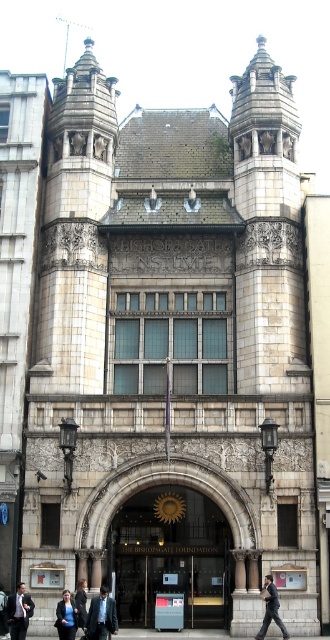
Question: Is dark gray suit at center below dark blue suit at lower left?

Choices:
 (A) no
 (B) yes

Answer: (B)

Question: Among these objects, which one is farthest from the camera?

Choices:
 (A) dark gray suit at center
 (B) dark suit at center
 (C) dark blue suit at center

Answer: (A)

Question: Is dark gray suit at center positioned behind dark blue suit at lower left?

Choices:
 (A) no
 (B) yes

Answer: (B)

Question: Can you confirm if dark blue suit at center is thinner than dark suit at center?

Choices:
 (A) no
 (B) yes

Answer: (A)

Question: Which is farther from the dark gray suit at center?

Choices:
 (A) dark blue suit at center
 (B) dark blue suit at lower left

Answer: (B)

Question: Which object appears closest to the camera in this image?

Choices:
 (A) dark blue suit at center
 (B) dark blue suit at lower left

Answer: (A)